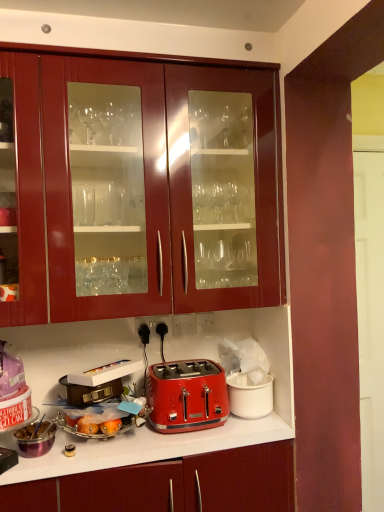
Measure the distance between metallic silver bowl at lower left, the 1th appliance viewed from the left, and camera.

The depth of metallic silver bowl at lower left, the 1th appliance viewed from the left, is 1.37 meters.

The height and width of the screenshot is (512, 384). What do you see at coordinates (153, 323) in the screenshot?
I see `black plastic electrical outlet at lower center` at bounding box center [153, 323].

This screenshot has height=512, width=384. Describe the element at coordinates (250, 395) in the screenshot. I see `red plastic toaster at center, acting as the 1th appliance starting from the right` at that location.

In order to click on matte red toaster at center in this screenshot , I will do `click(146, 448)`.

From the image's perspective, which one is positioned lower, black plastic electrical outlet at lower center or red metallic toaster at center?

red metallic toaster at center, from the image's perspective.

Would you say black plastic electrical outlet at lower center contains red metallic toaster at center?

No, black plastic electrical outlet at lower center does not contain red metallic toaster at center.

Is black plastic electrical outlet at lower center to the left of red metallic toaster at center from the viewer's perspective?

Correct, you'll find black plastic electrical outlet at lower center to the left of red metallic toaster at center.

Is black plastic electrical outlet at lower center bigger or smaller than red metallic toaster at center?

Clearly, black plastic electrical outlet at lower center is smaller in size than red metallic toaster at center.

Does metallic silver toaster at lower center have a lesser height compared to matte red toaster at center?

Correct, metallic silver toaster at lower center is not as tall as matte red toaster at center.

From a real-world perspective, is metallic silver toaster at lower center positioned over matte red toaster at center based on gravity?

Correct, in the physical world, metallic silver toaster at lower center is higher than matte red toaster at center.

Is point (5, 409) positioned before point (8, 482)?

No, it is not.

I want to click on countertop below the metallic silver toaster at lower center (from the image's perspective), so click(x=146, y=448).

Is metallic silver toaster at lower left positioned behind metallic silver toaster at lower center?

No.

Is point (11, 458) positioned behind point (18, 409)?

No, it is in front of (18, 409).

Is the surface of metallic silver toaster at lower left in direct contact with metallic silver toaster at lower center?

No, metallic silver toaster at lower left is not in contact with metallic silver toaster at lower center.

From a real-world perspective, which is physically above, metallic silver toaster at lower left or metallic silver toaster at lower center?

From a 3D spatial view, metallic silver toaster at lower center is above.

Looking at this image, is red plastic toaster at center, the 3th appliance viewed from the left, thinner than metallic silver bowl at lower left, the 1th appliance viewed from the left?

In fact, red plastic toaster at center, the 3th appliance viewed from the left, might be wider than metallic silver bowl at lower left, the 1th appliance viewed from the left.

Identify the location of the 2nd appliance behind the metallic silver bowl at lower left, the 1th appliance viewed from the left, starting your count from the anchor. The image size is (384, 512). (250, 395).

From the image's perspective, between red plastic toaster at center, the 3th appliance viewed from the left, and metallic silver bowl at lower left, the third appliance positioned from the right, which one is located above?

red plastic toaster at center, the 3th appliance viewed from the left, is shown above in the image.

Considering the positions of objects red plastic toaster at center, the 3th appliance viewed from the left, and metallic silver bowl at lower left, the 1th appliance viewed from the left, in the image provided, who is in front, red plastic toaster at center, the 3th appliance viewed from the left, or metallic silver bowl at lower left, the 1th appliance viewed from the left,?

metallic silver bowl at lower left, the 1th appliance viewed from the left, is closer to the camera.

Where is `the 1st appliance to the left when counting from the red plastic toaster at center, acting as the 1th appliance starting from the right`? This screenshot has width=384, height=512. the 1st appliance to the left when counting from the red plastic toaster at center, acting as the 1th appliance starting from the right is located at coordinates (91, 392).

From the picture: Considering the positions of objects red plastic toaster at center, the 3th appliance viewed from the left, and brown leather suitcase at lower left, which is the 2th appliance in right-to-left order, in the image provided, who is in front, red plastic toaster at center, the 3th appliance viewed from the left, or brown leather suitcase at lower left, which is the 2th appliance in right-to-left order,?

brown leather suitcase at lower left, which is the 2th appliance in right-to-left order, is in front.

Is red plastic toaster at center, acting as the 1th appliance starting from the right, taller or shorter than brown leather suitcase at lower left, the second appliance viewed from the left?

red plastic toaster at center, acting as the 1th appliance starting from the right, is taller than brown leather suitcase at lower left, the second appliance viewed from the left.

Which is more distant, (262, 404) or (109, 385)?

Positioned behind is point (262, 404).

Does red metallic toaster at center touch black plastic electrical outlet at lower center?

They are not placed beside each other.

How many degrees apart are the facing directions of red metallic toaster at center and black plastic electrical outlet at lower center?

7.11 degrees.

In terms of height, does red metallic toaster at center look taller or shorter compared to black plastic electrical outlet at lower center?

In the image, red metallic toaster at center appears to be taller than black plastic electrical outlet at lower center.

Does red metallic toaster at center turn towards black plastic electrical outlet at lower center?

No, red metallic toaster at center is not turned towards black plastic electrical outlet at lower center.

Would you say black plastic electrical outlet at lower center is a long distance from glossy wood cabinets at upper center?

black plastic electrical outlet at lower center is near glossy wood cabinets at upper center, not far away.

How much distance is there between black plastic electrical outlet at lower center and glossy wood cabinets at upper center?

24.92 inches.

In terms of size, does black plastic electrical outlet at lower center appear bigger or smaller than glossy wood cabinets at upper center?

In the image, black plastic electrical outlet at lower center appears to be smaller than glossy wood cabinets at upper center.

Where is `toaster below the black plastic electrical outlet at lower center (from a real-world perspective)`? toaster below the black plastic electrical outlet at lower center (from a real-world perspective) is located at coordinates (187, 396).

Identify the location of kitchen appliance on the left of the matte red toaster at center. Image resolution: width=384 pixels, height=512 pixels. pyautogui.click(x=15, y=409).

Considering their positions, is metallic silver toaster at lower center positioned closer to metallic silver toaster at lower left than brown leather suitcase at lower left, which is the 2th appliance in right-to-left order?

Based on the image, metallic silver toaster at lower center appears to be nearer to metallic silver toaster at lower left.

When comparing their distances from metallic silver toaster at lower left, does metallic silver toaster at lower center or black plastic electrical outlet at lower center seem closer?

metallic silver toaster at lower center lies closer to metallic silver toaster at lower left than the other object.

Looking at the image, which one is located closer to glossy wood cabinets at upper center, red plastic toaster at center, the 3th appliance viewed from the left, or black plastic electrical outlet at lower center?

Among the two, black plastic electrical outlet at lower center is located nearer to glossy wood cabinets at upper center.

Which object lies nearer to the anchor point metallic silver toaster at lower center, black plastic electrical outlet at lower center or metallic silver toaster at lower left?

Based on the image, metallic silver toaster at lower left appears to be nearer to metallic silver toaster at lower center.

Based on their spatial positions, is metallic silver toaster at lower center or black plastic electrical outlet at lower center further from metallic silver bowl at lower left, the 1th appliance viewed from the left?

Among the two, black plastic electrical outlet at lower center is located further to metallic silver bowl at lower left, the 1th appliance viewed from the left.

When comparing their distances from glossy wood cabinets at upper center, does metallic silver bowl at lower left, the 1th appliance viewed from the left, or red metallic toaster at center seem closer?

The object closer to glossy wood cabinets at upper center is red metallic toaster at center.

When comparing their distances from metallic silver bowl at lower left, the 1th appliance viewed from the left, does black plastic electrical outlet at lower center or red metallic toaster at center seem closer?

red metallic toaster at center.

Considering their positions, is metallic silver toaster at lower left positioned further to red plastic toaster at center, acting as the 1th appliance starting from the right, than glossy wood cabinets at upper center?

metallic silver toaster at lower left.

Where is `home appliance between metallic silver toaster at lower center and black plastic electrical outlet at lower center`? Image resolution: width=384 pixels, height=512 pixels. home appliance between metallic silver toaster at lower center and black plastic electrical outlet at lower center is located at coordinates (7, 459).

This screenshot has width=384, height=512. I want to click on electric outlet between glossy wood cabinets at upper center and metallic silver toaster at lower left vertically, so click(x=153, y=323).

This screenshot has width=384, height=512. I want to click on kitchen appliance that lies between glossy wood cabinets at upper center and matte red toaster at center from top to bottom, so click(15, 409).

Image resolution: width=384 pixels, height=512 pixels. I want to click on electric outlet between metallic silver toaster at lower center and red plastic toaster at center, acting as the 1th appliance starting from the right, so click(x=153, y=323).